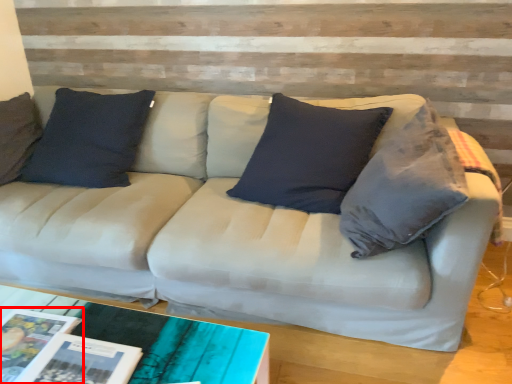
Question: From the image's perspective, where is magazine (annotated by the red box) located in relation to magazine in the image?

Choices:
 (A) above
 (B) below

Answer: (A)